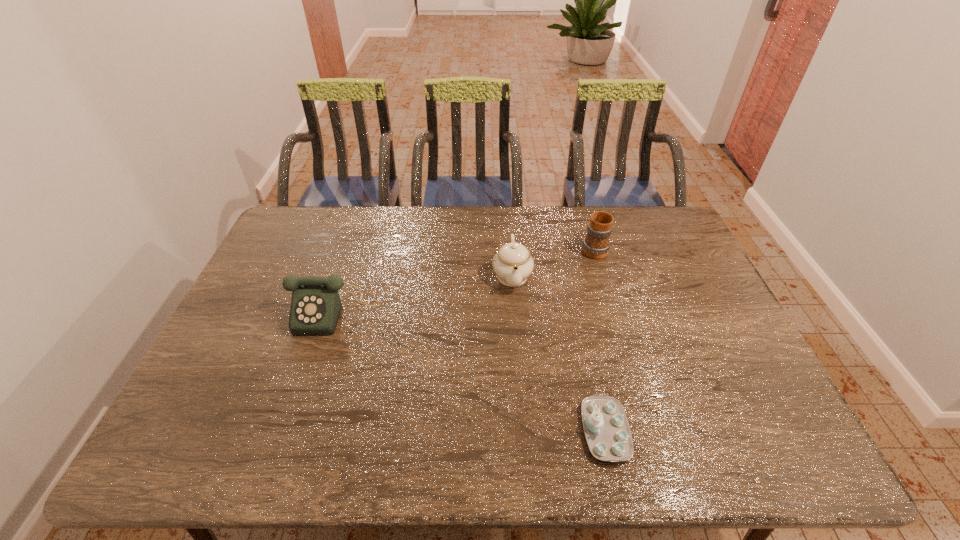
The width and height of the screenshot is (960, 540). I want to click on object that stands as the third closest to the mug, so click(315, 308).

Identify which object is the second nearest to the taller chinaware. Please provide its 2D coordinates. Your answer should be formatted as a tuple, i.e. [(x, y)], where the tuple contains the x and y coordinates of a point satisfying the conditions above.

[(315, 308)]

You are a GUI agent. You are given a task and a screenshot of the screen. Output one action in this format:
    pyautogui.click(x=<x>, y=<y>)
    Task: Click on the vacant space that satisfies the following two spatial constraints: 1. on the dial of the shorter chinaware; 2. on the left side of the telephone
    
    Given the screenshot: What is the action you would take?
    297,430

I want to click on free spot that satisfies the following two spatial constraints: 1. at the spout of the shortest object; 2. on the left side of the left chinaware, so click(x=524, y=430).

Locate an element on the screen. The height and width of the screenshot is (540, 960). vacant space that satisfies the following two spatial constraints: 1. on the dial of the nearest object; 2. on the left side of the leftmost object is located at coordinates (297, 430).